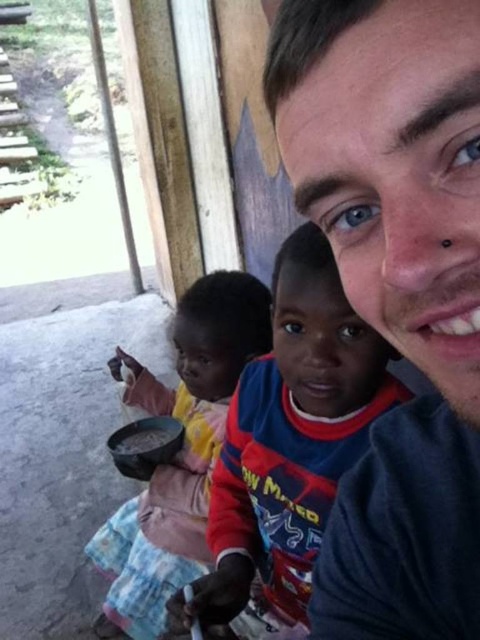
Question: Considering the relative positions of smooth gray shirt at center and reddish-brown fabric shirt at center in the image provided, where is smooth gray shirt at center located with respect to reddish-brown fabric shirt at center?

Choices:
 (A) below
 (B) above

Answer: (B)

Question: Does reddish-brown fabric shirt at center have a greater width compared to matte plastic bowl at lower left?

Choices:
 (A) no
 (B) yes

Answer: (A)

Question: Which point appears closest to the camera in this image?

Choices:
 (A) (179, 460)
 (B) (135, 442)
 (C) (472, 120)
 (D) (287, 280)

Answer: (C)

Question: Which of the following is the closest to the observer?

Choices:
 (A) [x=433, y=72]
 (B) [x=179, y=346]

Answer: (A)

Question: Where is matte plastic bowl at lower left located in relation to smooth brown rice at lower left in the image?

Choices:
 (A) below
 (B) above

Answer: (A)

Question: Which point appears farthest from the camera in this image?

Choices:
 (A) (429, 550)
 (B) (312, 364)

Answer: (B)